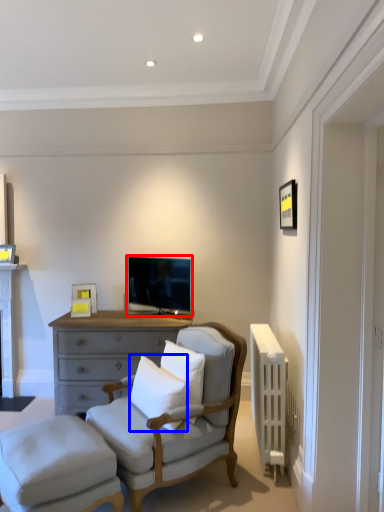
Question: Which object appears farthest to the camera in this image, television (highlighted by a red box) or pillow (highlighted by a blue box)?

Choices:
 (A) television
 (B) pillow

Answer: (A)